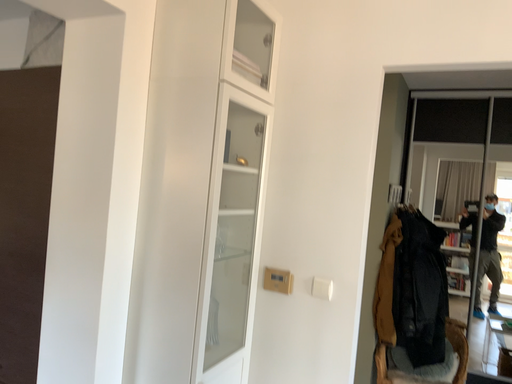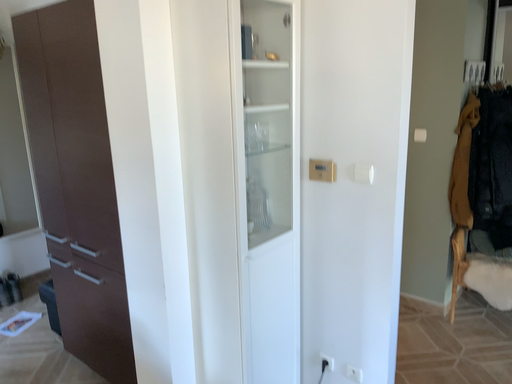
Question: Which way did the camera rotate in the video?

Choices:
 (A) rotated left
 (B) rotated right

Answer: (A)